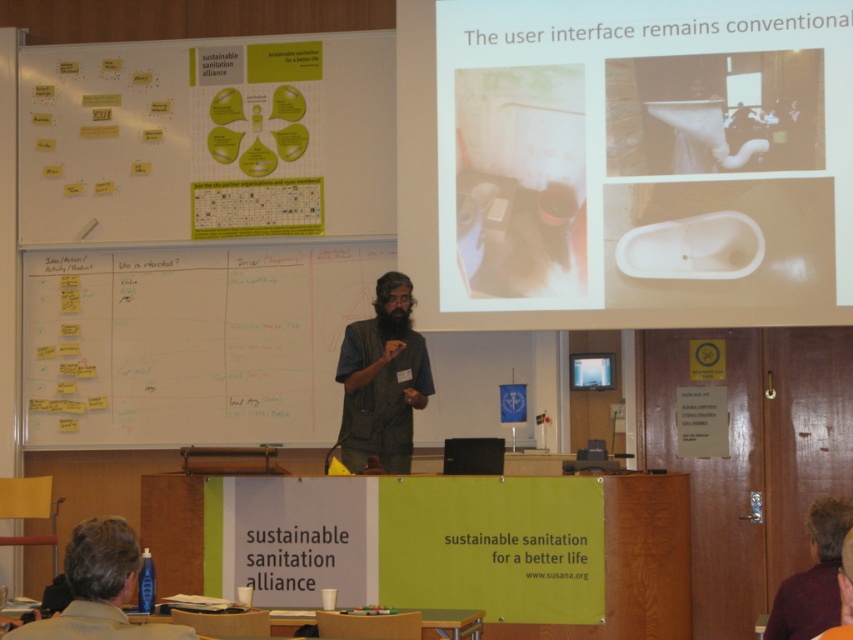
Question: Which is farther from the white plastic toilet at upper right?

Choices:
 (A) maroon fabric shirt at lower right
 (B) brown hair at lower left
 (C) brown cotton shirt at center

Answer: (B)

Question: Which point appears closest to the camera in this image?

Choices:
 (A) 810,595
 (B) 395,422
 (C) 509,285
 (D) 114,544

Answer: (D)

Question: From the image, what is the correct spatial relationship of brown cotton shirt at center in relation to maroon fabric shirt at lower right?

Choices:
 (A) below
 (B) above

Answer: (B)

Question: Which object appears farthest from the camera in this image?

Choices:
 (A) maroon fabric shirt at lower right
 (B) brown cotton shirt at center
 (C) brown hair at lower left
 (D) white plastic toilet at upper right

Answer: (D)

Question: Is brown hair at lower left bigger than maroon fabric shirt at lower right?

Choices:
 (A) yes
 (B) no

Answer: (A)

Question: Does brown cotton shirt at center appear on the right side of maroon fabric shirt at lower right?

Choices:
 (A) yes
 (B) no

Answer: (B)